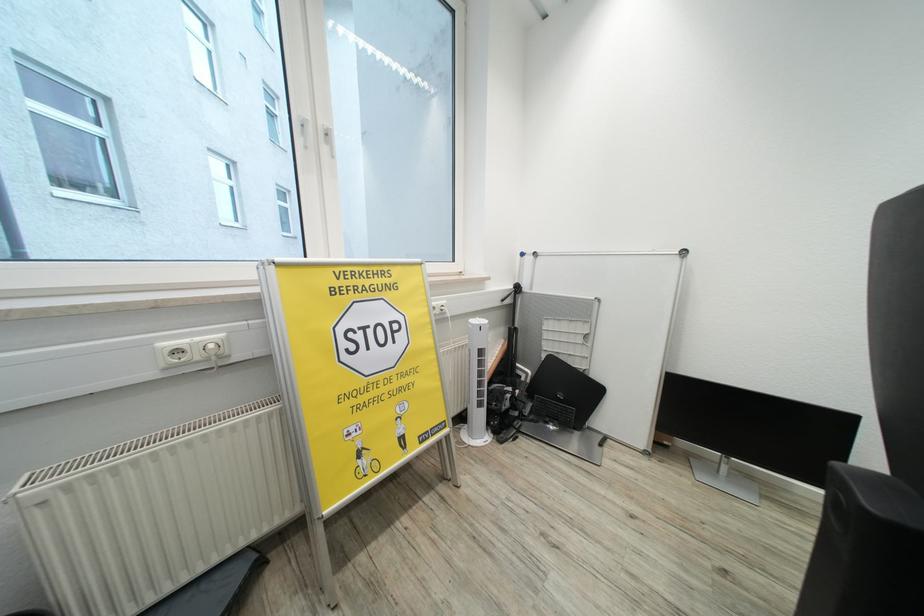
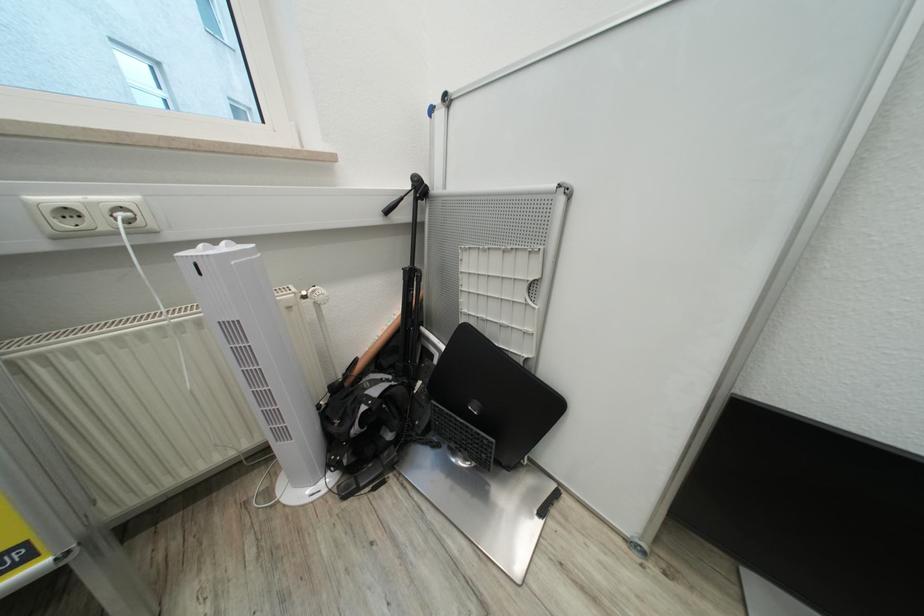
Which direction would the cameraman need to move to produce the second image?

The movement direction of the cameraman is right, forward.